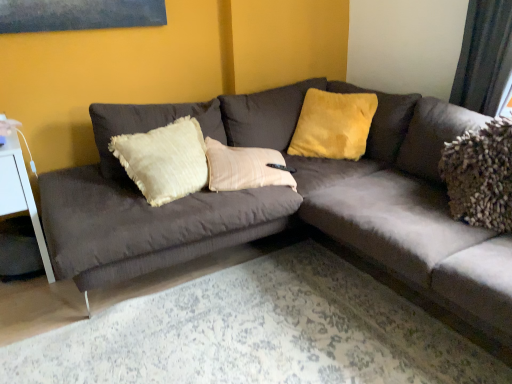
Find the location of a particular element. Image resolution: width=512 pixels, height=384 pixels. suede-like dark gray couch at center is located at coordinates (287, 203).

The height and width of the screenshot is (384, 512). Find the location of `white glossy side table at left`. white glossy side table at left is located at coordinates (20, 194).

Is white glossy side table at left oriented towards velvet yellow pillow at upper center?

No, white glossy side table at left is not aimed at velvet yellow pillow at upper center.

Can we say white glossy side table at left lies outside velvet yellow pillow at upper center?

Yes, white glossy side table at left is outside of velvet yellow pillow at upper center.

At what (x,y) coordinates should I click in order to perform the action: click on pillow above the white glossy side table at left (from the image's perspective). Please return your answer as a coordinate pair (x, y). The width and height of the screenshot is (512, 384). Looking at the image, I should click on (333, 125).

From a real-world perspective, between white glossy side table at left and velvet yellow pillow at upper center, who is vertically lower?

white glossy side table at left, from a real-world perspective.

The height and width of the screenshot is (384, 512). I want to click on studio couch in front of the white glossy side table at left, so click(287, 203).

Between point (319, 200) and point (26, 186), which one is positioned in front?

Positioned in front is point (26, 186).

Measure the distance between suede-like dark gray couch at center and white glossy side table at left.

34.10 inches.

Is white glossy side table at left surrounding suede-like dark gray couch at center?

No, suede-like dark gray couch at center is located outside of white glossy side table at left.

Relative to suede-like dark gray couch at center, is white glossy side table at left in front or behind?

Clearly, white glossy side table at left is behind suede-like dark gray couch at center.

Considering the relative sizes of white glossy side table at left and suede-like dark gray couch at center in the image provided, is white glossy side table at left smaller than suede-like dark gray couch at center?

Correct, white glossy side table at left occupies less space than suede-like dark gray couch at center.

Considering the sizes of objects velvet yellow pillow at upper center and white glossy side table at left in the image provided, who is smaller, velvet yellow pillow at upper center or white glossy side table at left?

Smaller between the two is velvet yellow pillow at upper center.

In order to click on pillow that appears on the right of white glossy side table at left in this screenshot , I will do `click(333, 125)`.

Is velvet yellow pillow at upper center facing towards white glossy side table at left?

No.

From the picture: From the image's perspective, between velvet yellow pillow at upper center and white glossy side table at left, which one is located above?

velvet yellow pillow at upper center, from the image's perspective.

From their relative heights in the image, would you say velvet yellow pillow at upper center is taller or shorter than suede-like dark gray couch at center?

Clearly, velvet yellow pillow at upper center is shorter compared to suede-like dark gray couch at center.

Is velvet yellow pillow at upper center facing away from suede-like dark gray couch at center?

Yes, velvet yellow pillow at upper center's orientation is away from suede-like dark gray couch at center.

Is velvet yellow pillow at upper center positioned in front of suede-like dark gray couch at center?

No.

Is velvet yellow pillow at upper center completely or partially outside of suede-like dark gray couch at center?

No, velvet yellow pillow at upper center is inside suede-like dark gray couch at center's boundary.

Between point (407, 176) and point (296, 127), which one is positioned behind?

The point (296, 127) is farther from the camera.

I want to click on studio couch located underneath the velvet yellow pillow at upper center (from a real-world perspective), so click(x=287, y=203).

From the picture: From a real-world perspective, is suede-like dark gray couch at center above or below velvet yellow pillow at upper center?

suede-like dark gray couch at center is below velvet yellow pillow at upper center.

Which is more to the right, suede-like dark gray couch at center or velvet yellow pillow at upper center?

velvet yellow pillow at upper center is more to the right.

Image resolution: width=512 pixels, height=384 pixels. Identify the location of pillow located on the right of white glossy side table at left. (333, 125).

You are a GUI agent. You are given a task and a screenshot of the screen. Output one action in this format:
    pyautogui.click(x=<x>, y=<y>)
    Task: Click on the table on the left of suede-like dark gray couch at center
    Image resolution: width=512 pixels, height=384 pixels.
    Given the screenshot: What is the action you would take?
    [x=20, y=194]

From the image, which object appears to be nearer to velvet yellow pillow at upper center, suede-like dark gray couch at center or white glossy side table at left?

suede-like dark gray couch at center lies closer to velvet yellow pillow at upper center than the other object.

When comparing their distances from suede-like dark gray couch at center, does velvet yellow pillow at upper center or white glossy side table at left seem closer?

velvet yellow pillow at upper center.

Looking at the image, which one is located closer to suede-like dark gray couch at center, white glossy side table at left or velvet yellow pillow at upper center?

velvet yellow pillow at upper center lies closer to suede-like dark gray couch at center than the other object.

Based on their spatial positions, is suede-like dark gray couch at center or velvet yellow pillow at upper center closer to white glossy side table at left?

suede-like dark gray couch at center.

From the image, which object appears to be nearer to velvet yellow pillow at upper center, white glossy side table at left or suede-like dark gray couch at center?

suede-like dark gray couch at center lies closer to velvet yellow pillow at upper center than the other object.

From the image, which object appears to be farther from white glossy side table at left, velvet yellow pillow at upper center or suede-like dark gray couch at center?

velvet yellow pillow at upper center lies further to white glossy side table at left than the other object.

Image resolution: width=512 pixels, height=384 pixels. What are the coordinates of `table between suede-like dark gray couch at center and velvet yellow pillow at upper center along the z-axis` in the screenshot? It's located at (20, 194).